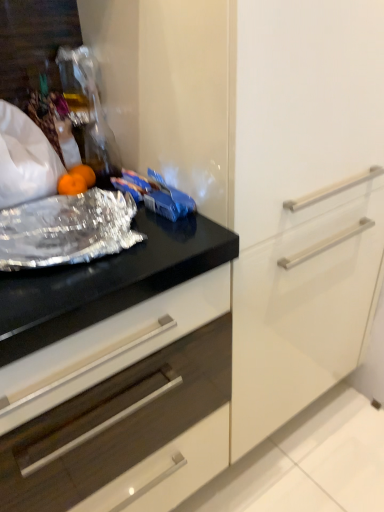
Question: In the image, is shiny metallic foil at left on the left side or the right side of black glossy countertop at center?

Choices:
 (A) right
 (B) left

Answer: (A)

Question: In terms of width, does shiny metallic foil at left look wider or thinner when compared to black glossy countertop at center?

Choices:
 (A) wide
 (B) thin

Answer: (B)

Question: From a real-world perspective, is shiny metallic foil at left positioned above or below black glossy countertop at center?

Choices:
 (A) above
 (B) below

Answer: (A)

Question: Is black glossy countertop at center situated inside shiny metallic foil at left or outside?

Choices:
 (A) inside
 (B) outside

Answer: (B)

Question: Does point (196, 294) appear closer or farther from the camera than point (46, 211)?

Choices:
 (A) farther
 (B) closer

Answer: (B)

Question: In terms of width, does black glossy countertop at center look wider or thinner when compared to shiny metallic foil at left?

Choices:
 (A) wide
 (B) thin

Answer: (A)

Question: Relative to shiny metallic foil at left, is black glossy countertop at center in front or behind?

Choices:
 (A) behind
 (B) front

Answer: (B)